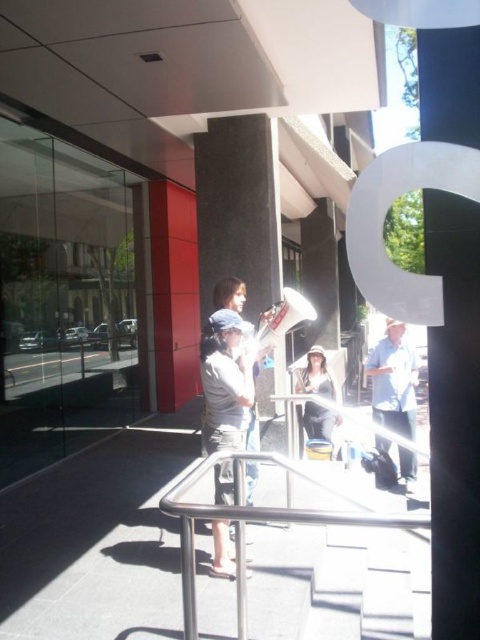
Question: Which point appears closest to the camera in this image?

Choices:
 (A) (384, 364)
 (B) (312, 412)

Answer: (A)

Question: Is denim jacket at center behind light blue denim shirt at center?

Choices:
 (A) no
 (B) yes

Answer: (A)

Question: Which of the following is the farthest from the observer?

Choices:
 (A) (248, 269)
 (B) (223, 545)
 (C) (243, 582)

Answer: (A)

Question: Among these points, which one is nearest to the camera?

Choices:
 (A) (384, 420)
 (B) (252, 179)

Answer: (B)

Question: Can you confirm if black polished stone pillar at center is smaller than light blue denim shirt at center?

Choices:
 (A) no
 (B) yes

Answer: (B)

Question: Is satin silver railing at center wider than light blue denim shirt at center?

Choices:
 (A) no
 (B) yes

Answer: (B)